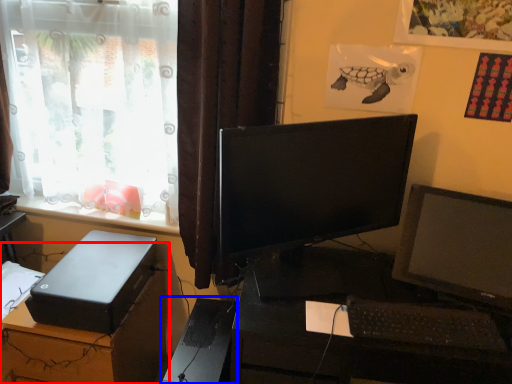
Question: Which point is further to the camera, desk (highlighted by a red box) or computer tower (highlighted by a blue box)?

Choices:
 (A) desk
 (B) computer tower

Answer: (A)